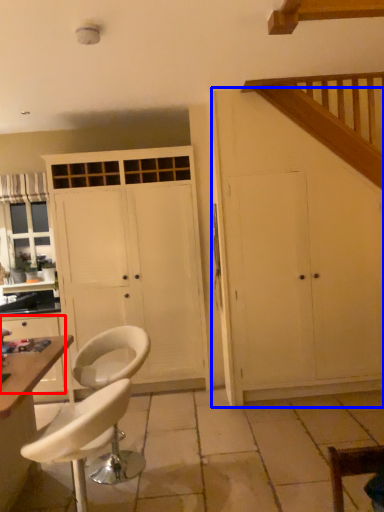
Question: Which of the following is the farthest to the observer, cabinetry (highlighted by a red box) or cupboard (highlighted by a blue box)?

Choices:
 (A) cabinetry
 (B) cupboard

Answer: (A)